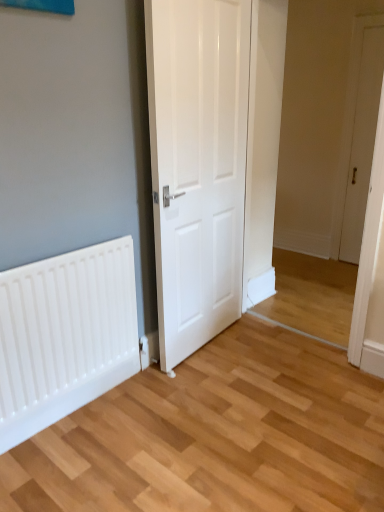
Question: Considering the positions of white glossy door at center, positioned as the first door in front-to-back order, and white wooden door at right, positioned as the first door in back-to-front order, in the image, is white glossy door at center, positioned as the first door in front-to-back order, taller or shorter than white wooden door at right, positioned as the first door in back-to-front order,?

Choices:
 (A) short
 (B) tall

Answer: (A)

Question: Based on their sizes in the image, would you say white glossy door at center, the 1th door positioned from the left, is bigger or smaller than white wooden door at right, the second door from the front?

Choices:
 (A) big
 (B) small

Answer: (A)

Question: Which of these objects is positioned closest to the white matte radiator at lower left?

Choices:
 (A) white wooden door at right, the 1th door viewed from the right
 (B) white glossy door at center, positioned as the first door in front-to-back order

Answer: (B)

Question: Considering the real-world distances, which object is farthest from the white wooden door at right, the 1th door viewed from the right?

Choices:
 (A) white matte radiator at lower left
 (B) white glossy door at center, positioned as the first door in front-to-back order

Answer: (A)